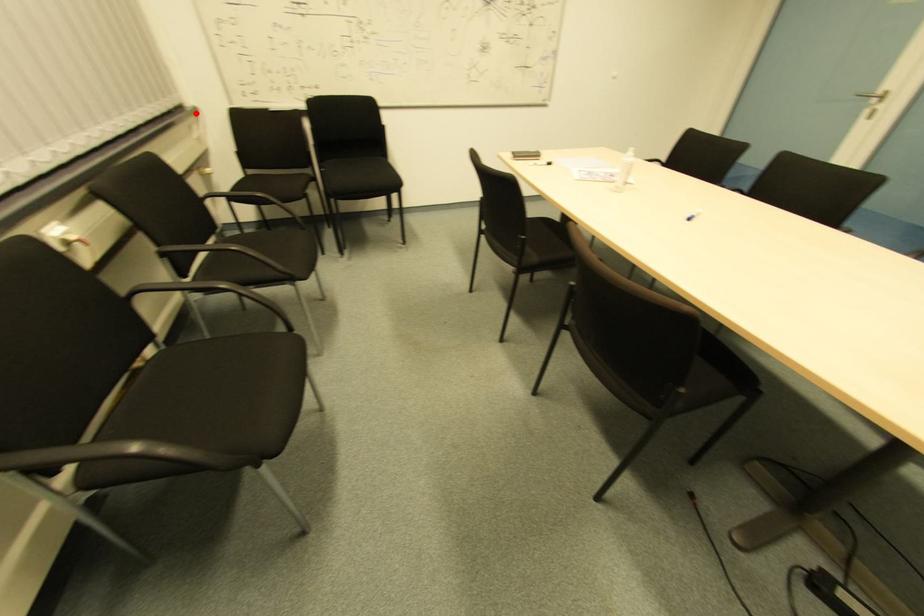
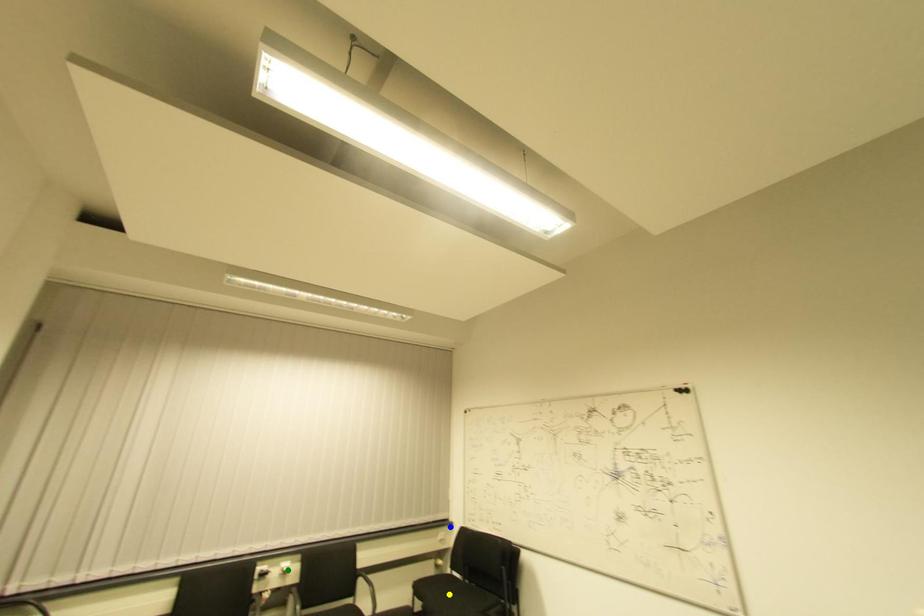
Question: I am providing you with two images of the same scene from different viewpoints. A red point is marked on the first image. You are given multiple points on the second image. Which point in image 2 is actually the same real-world point as the red point in image 1?

Choices:
 (A) yellow point
 (B) green point
 (C) blue point

Answer: (C)